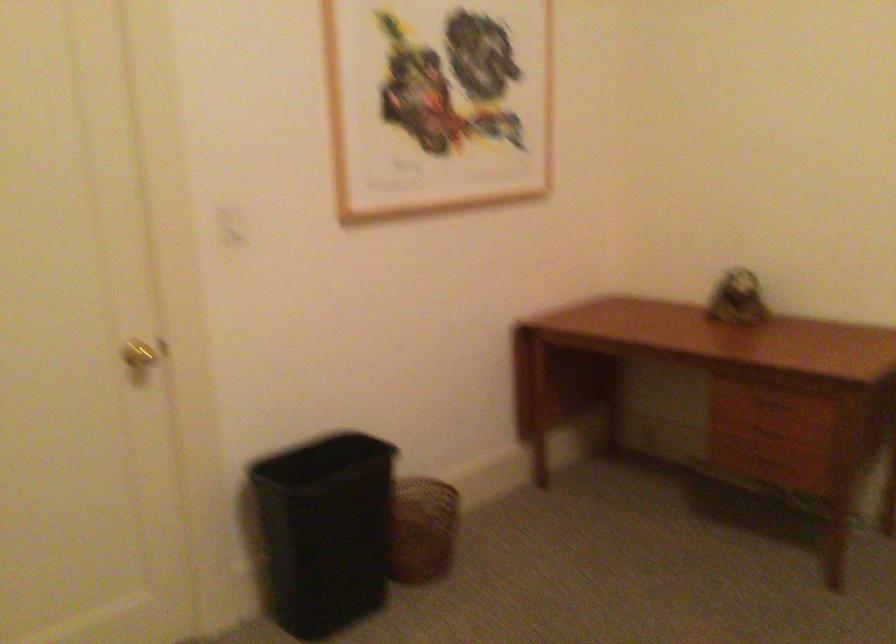
This screenshot has width=896, height=644. I want to click on black trash can, so click(x=323, y=531).